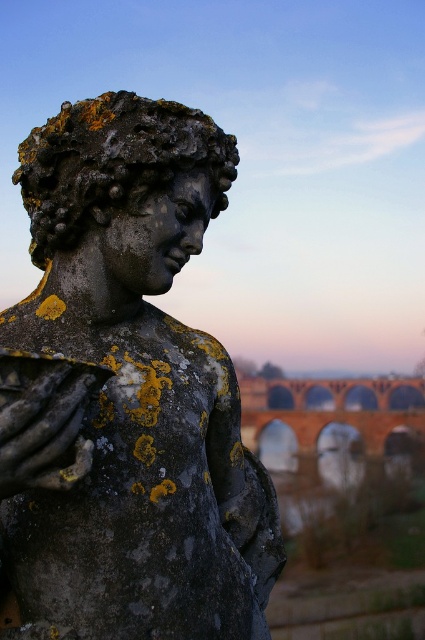
Does rusty stone statue at upper left have a larger size compared to brick/stone arches at center?

Yes, rusty stone statue at upper left is bigger than brick/stone arches at center.

Is rusty stone statue at upper left shorter than brick/stone arches at center?

No, rusty stone statue at upper left is not shorter than brick/stone arches at center.

The height and width of the screenshot is (640, 425). What do you see at coordinates (136, 388) in the screenshot? I see `rusty stone statue at upper left` at bounding box center [136, 388].

Find the location of a particular element. Image resolution: width=425 pixels, height=640 pixels. rusty stone statue at upper left is located at coordinates (136, 388).